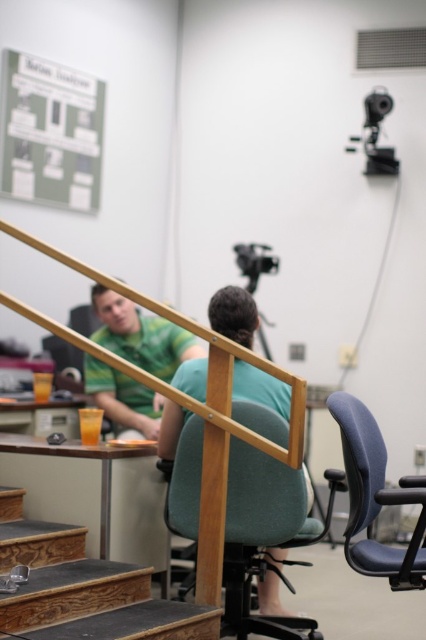
Question: Is green fabric chair at center behind blue fabric swivel chair at right?

Choices:
 (A) no
 (B) yes

Answer: (B)

Question: Does wooden stair at lower left lie behind green matte shirt at center?

Choices:
 (A) yes
 (B) no

Answer: (B)

Question: Among these points, which one is nearest to the camera?

Choices:
 (A) (2, 451)
 (B) (385, 458)
 (C) (135, 580)

Answer: (C)

Question: Does wooden stair at lower left appear under wooden table at lower left?

Choices:
 (A) yes
 (B) no

Answer: (A)

Question: Which object is the closest to the wooden stair at lower left?

Choices:
 (A) green fabric chair at center
 (B) black plastic video camera at upper right
 (C) blue fabric swivel chair at right

Answer: (A)

Question: Considering the real-world distances, which object is closest to the wooden table at lower left?

Choices:
 (A) wooden stair at lower left
 (B) green fabric chair at center
 (C) black plastic video camera at upper right

Answer: (A)